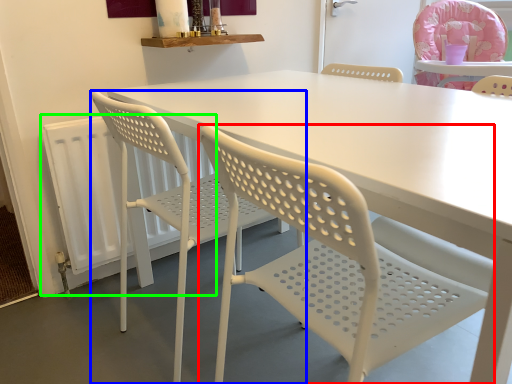
Question: Which object is the farthest from chair (highlighted by a red box)? Choose among these: chair (highlighted by a blue box) or radiator (highlighted by a green box).

Choices:
 (A) chair
 (B) radiator

Answer: (B)